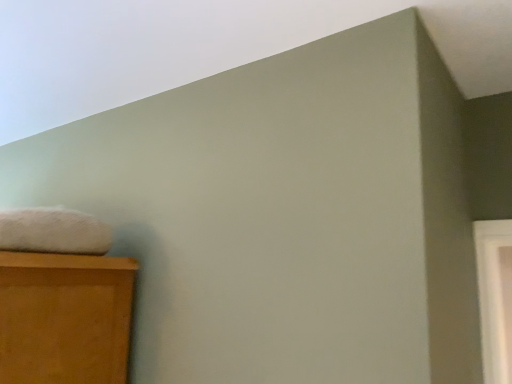
The width and height of the screenshot is (512, 384). Describe the element at coordinates (53, 231) in the screenshot. I see `white fluffy bath towel at upper left` at that location.

You are a GUI agent. You are given a task and a screenshot of the screen. Output one action in this format:
    pyautogui.click(x=<x>, y=<y>)
    Task: Click on the white fluffy bath towel at upper left
    
    Given the screenshot: What is the action you would take?
    pyautogui.click(x=53, y=231)

The width and height of the screenshot is (512, 384). I want to click on white fluffy bath towel at upper left, so click(x=53, y=231).